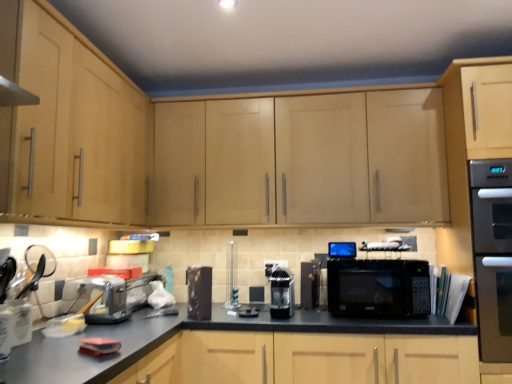
You are a GUI agent. You are given a task and a screenshot of the screen. Output one action in this format:
    pyautogui.click(x=<x>, y=<y>)
    Task: Click on the vacant point to the right of black glossy coffee maker at center, which is the 2th appliance from left to right
    
    Given the screenshot: What is the action you would take?
    pyautogui.click(x=227, y=319)